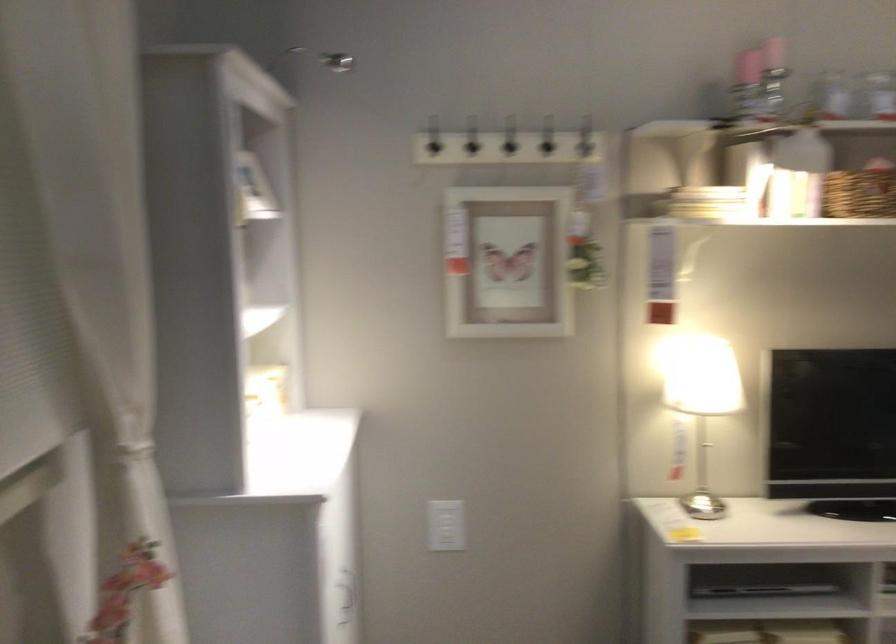
Where would you pull the wicker basket? Please return your answer as a coordinate pair (x, y).

(859, 192)